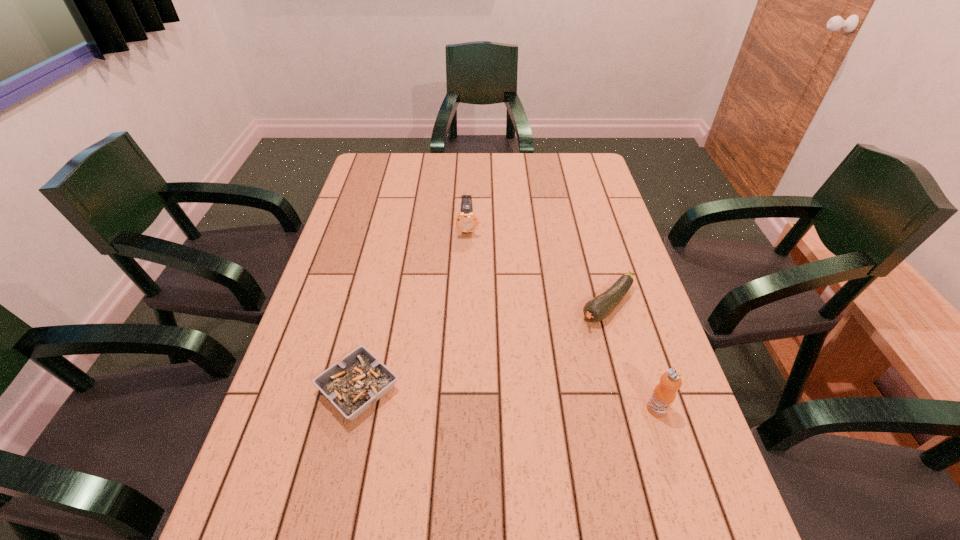
In the image, there is a desktop. Identify the location of vacant space at the left edge. (326, 260).

Where is `vacant space at the right edge of the desktop`? vacant space at the right edge of the desktop is located at coordinates (612, 202).

This screenshot has height=540, width=960. I want to click on blank area at the far left corner, so click(x=370, y=166).

At what (x,y) coordinates should I click in order to perform the action: click on vacant space at the near left corner of the desktop. Please return your answer as a coordinate pair (x, y). Image resolution: width=960 pixels, height=540 pixels. Looking at the image, I should click on (260, 500).

The image size is (960, 540). I want to click on vacant point at the far right corner, so click(558, 172).

Image resolution: width=960 pixels, height=540 pixels. I want to click on free point between the ashtray and the watch, so 414,308.

In order to click on unoccupied area between the zucchini and the third object from right to left in this screenshot , I will do `click(538, 267)`.

The width and height of the screenshot is (960, 540). What are the coordinates of `free space between the watch and the leftmost object` in the screenshot? It's located at (414, 308).

Find the location of `free point between the farthest object and the tallest object`. free point between the farthest object and the tallest object is located at coordinates (563, 319).

The image size is (960, 540). I want to click on vacant area that lies between the orange juice and the second tallest object, so click(563, 319).